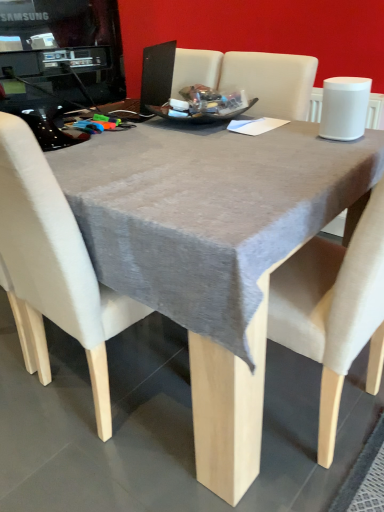
I want to click on free region under black glossy desktop computer at upper left (from a real-world perspective), so click(80, 129).